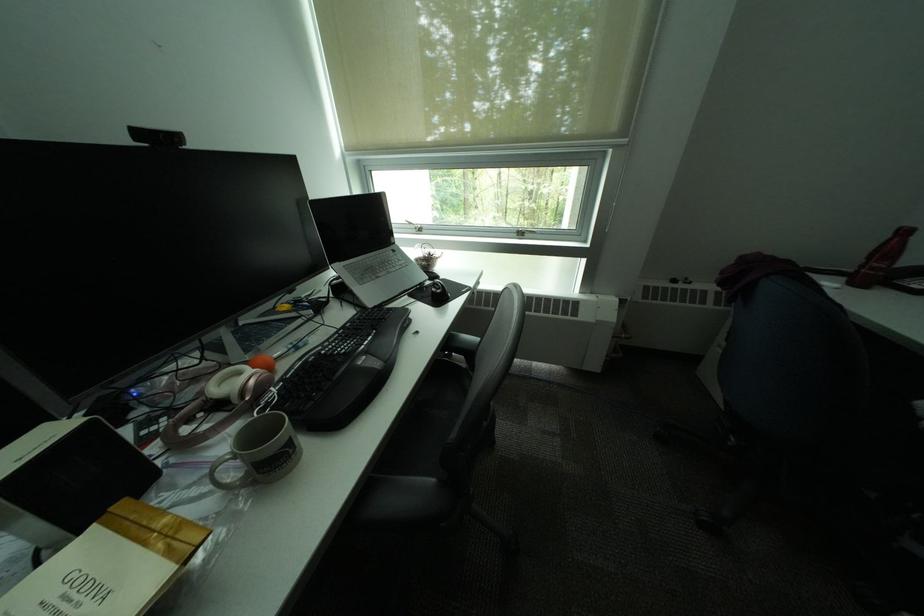
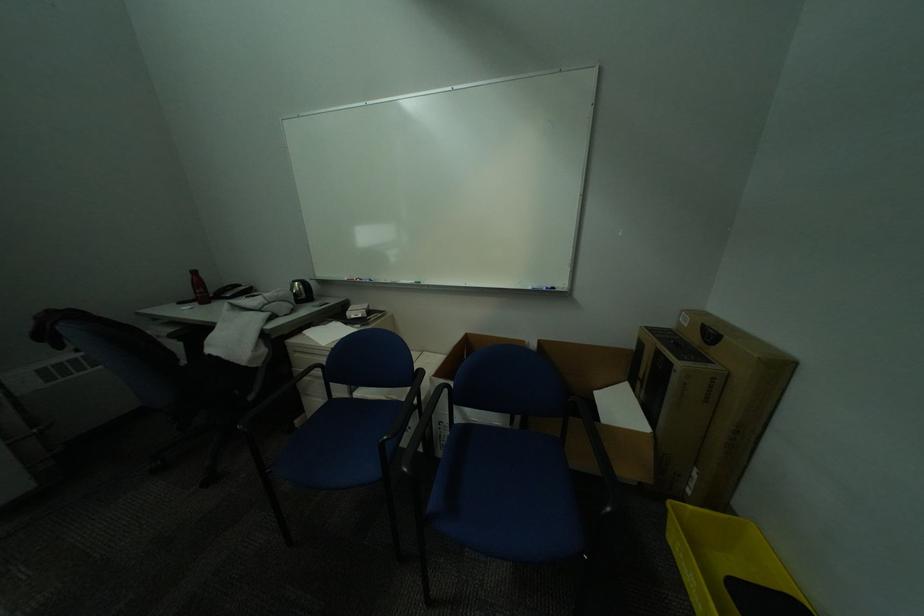
First-person continuous shooting, in which direction is the camera rotating?

The rotation direction of the camera is right-down.